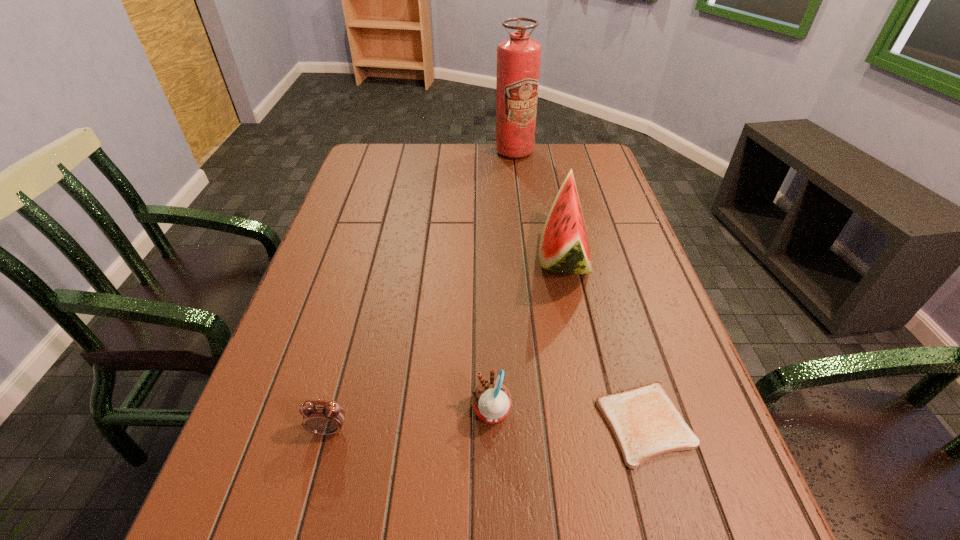
Find the location of a particular element. The width and height of the screenshot is (960, 540). free space between the farthest object and the leftmost object is located at coordinates (421, 291).

Identify the location of unoccupied position between the toast and the muffin. (568, 418).

At what (x,y) coordinates should I click in order to perform the action: click on free space between the fourth shortest object and the alarm clock. Please return your answer as a coordinate pair (x, y). Looking at the image, I should click on (446, 343).

What are the coordinates of `vacant space that is in between the watermelon and the farthest object` in the screenshot? It's located at (539, 204).

Find the location of `unoccupied area between the watermelon and the shortest object`. unoccupied area between the watermelon and the shortest object is located at coordinates (605, 340).

Point out which object is positioned as the third nearest to the tallest object. Please provide its 2D coordinates. Your answer should be formatted as a tuple, i.e. [(x, y)], where the tuple contains the x and y coordinates of a point satisfying the conditions above.

[(491, 399)]

Point out which object is positioned as the nearest to the leftmost object. Please provide its 2D coordinates. Your answer should be formatted as a tuple, i.e. [(x, y)], where the tuple contains the x and y coordinates of a point satisfying the conditions above.

[(491, 399)]

Locate an element on the screen. This screenshot has height=540, width=960. vacant space that satisfies the following two spatial constraints: 1. on the label side of the tallest object; 2. on the left side of the shortest object is located at coordinates pos(546,424).

The image size is (960, 540). Find the location of `free space that satisfies the following two spatial constraints: 1. on the outer rind of the second tallest object; 2. on the right side of the shortest object`. free space that satisfies the following two spatial constraints: 1. on the outer rind of the second tallest object; 2. on the right side of the shortest object is located at coordinates (599, 424).

I want to click on blank area in the image that satisfies the following two spatial constraints: 1. on the outer rind of the second tallest object; 2. on the right side of the shortest object, so click(x=599, y=424).